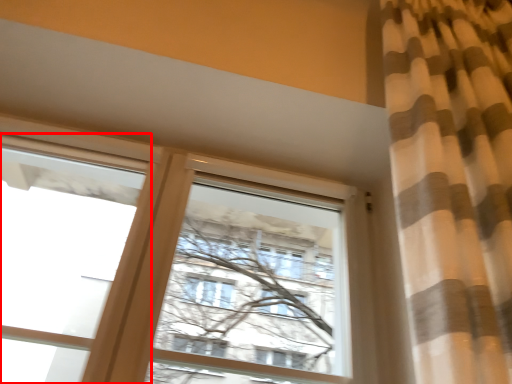
Question: From the image's perspective, where is window (annotated by the red box) located in relation to window in the image?

Choices:
 (A) above
 (B) below

Answer: (A)